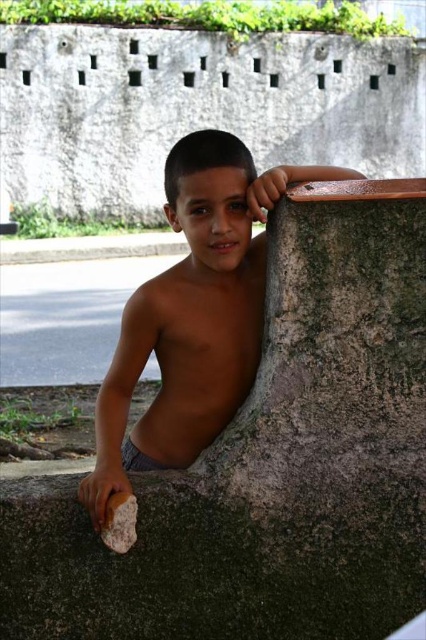
You are a photographer positioned at the point labeled point (x=5, y=509). You want to take a photo of the boy leaning against the wall. However, there is another photographer at point (x=172, y=266). Which photographer is closer to the boy?

The photographer at point (x=5, y=509) is closer to the boy because they are positioned in front of the photographer at point (x=172, y=266), who is further away.

You are a drone operator trying to land a drone on the green mossy concrete at upper center. According to the coordinates provided, where exactly should you position the drone to ensure a safe landing?

The green mossy concrete at upper center is located at point (270, 464), so you should position the drone precisely at those coordinates for a safe landing.

You are designing a garden layout and need to know the spatial relationship between the green mossy concrete at upper center and the brown matte stone at center. Which one takes up more area in the scene?

The brown matte stone at center occupies more space than the green mossy concrete at upper center.